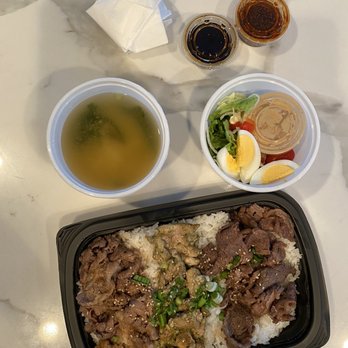
Find the location of a particular element. This screenshot has width=348, height=348. tray is located at coordinates (311, 310).